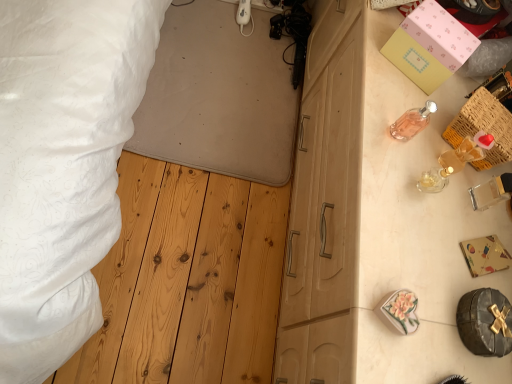
What are the coordinates of `free space that is to the left of gold foil gift box at right, positioned as the first box in front-to-back order` in the screenshot? It's located at pyautogui.click(x=419, y=210).